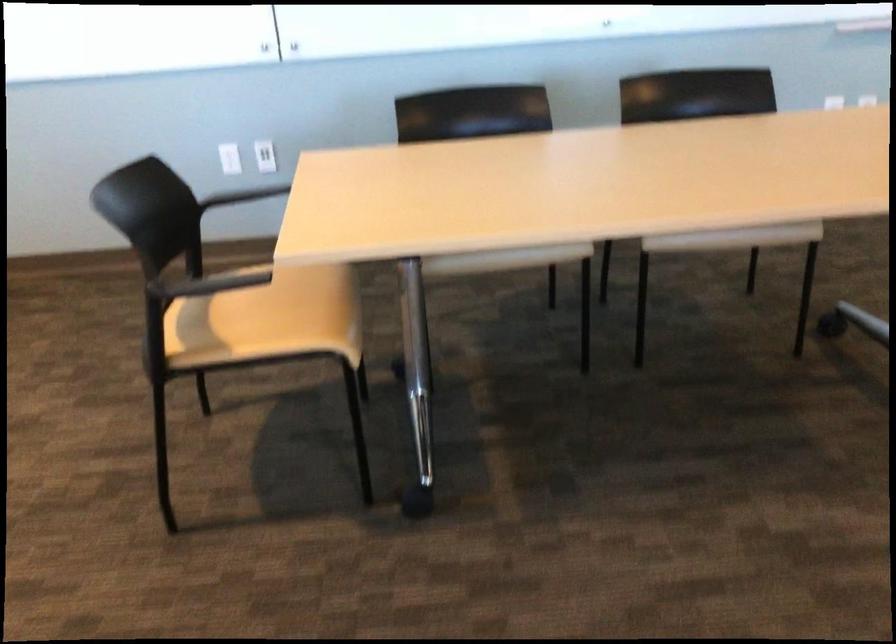
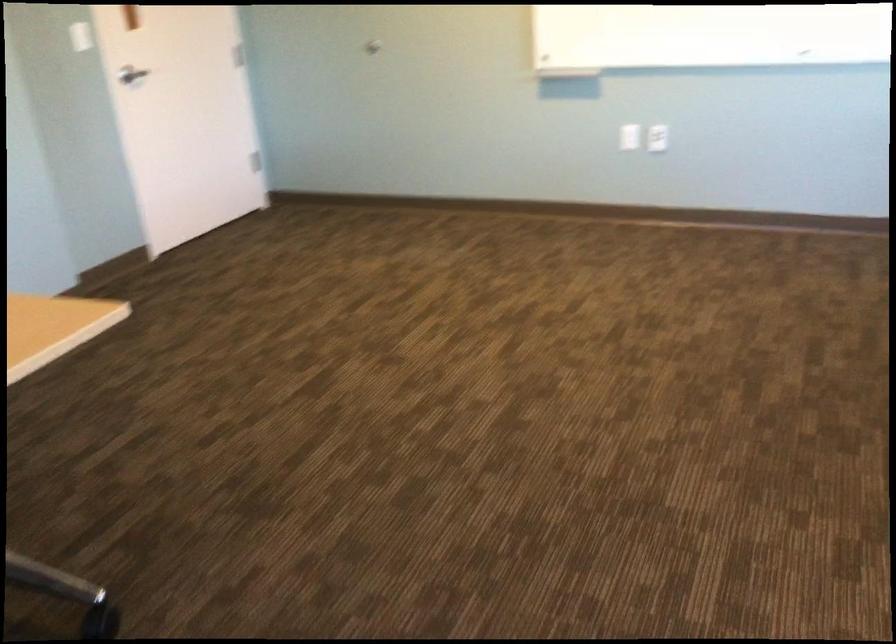
Question: The camera is either moving clockwise (left) or counter-clockwise (right) around the object. The first image is from the beginning of the video and the second image is from the end. Is the camera moving left or right when shooting the video?

Choices:
 (A) Left
 (B) Right

Answer: (A)